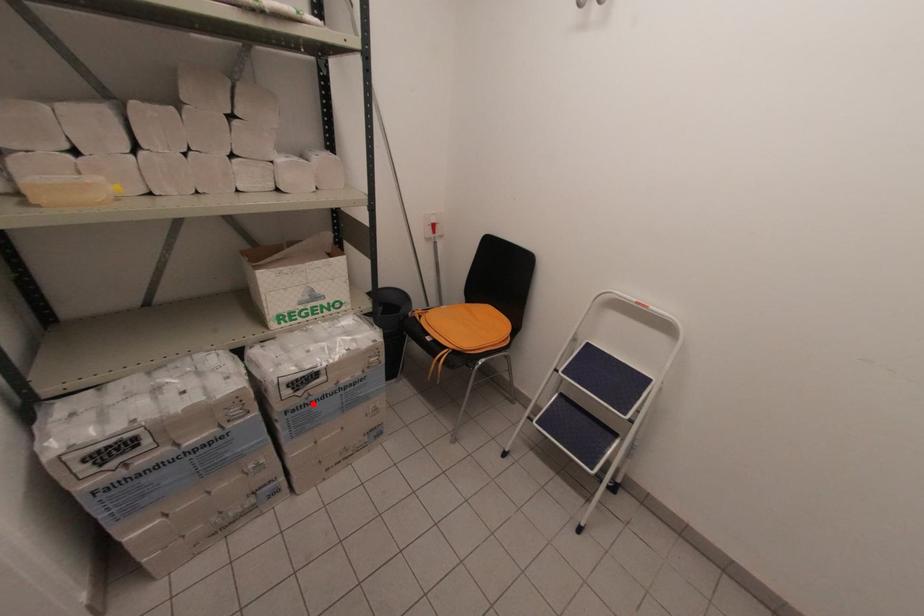
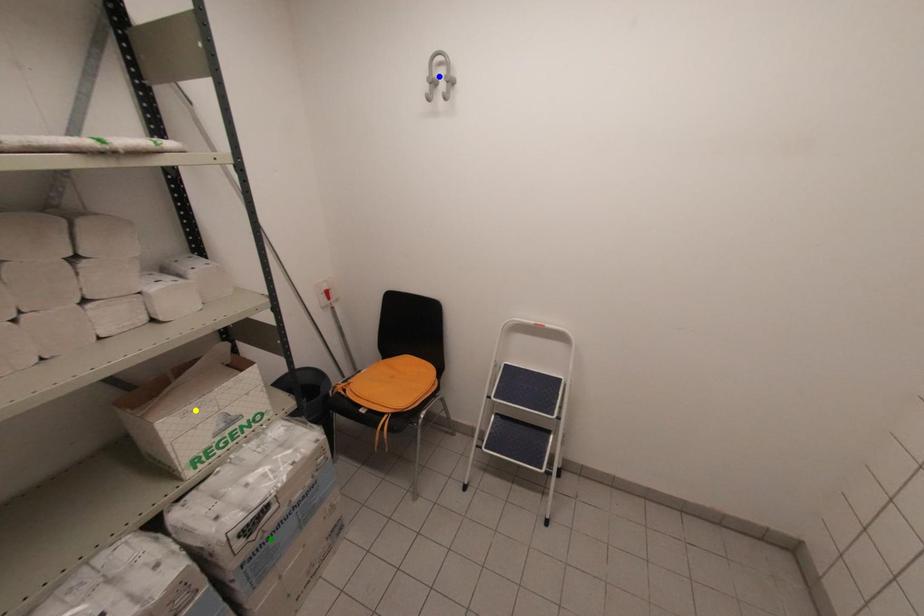
Question: I am providing you with two images of the same scene from different viewpoints. A red point is marked on the first image. You are given multiple points on the second image. Which point in image 2 is actually the same real-world point as the red point in image 1?

Choices:
 (A) blue point
 (B) yellow point
 (C) green point

Answer: (C)